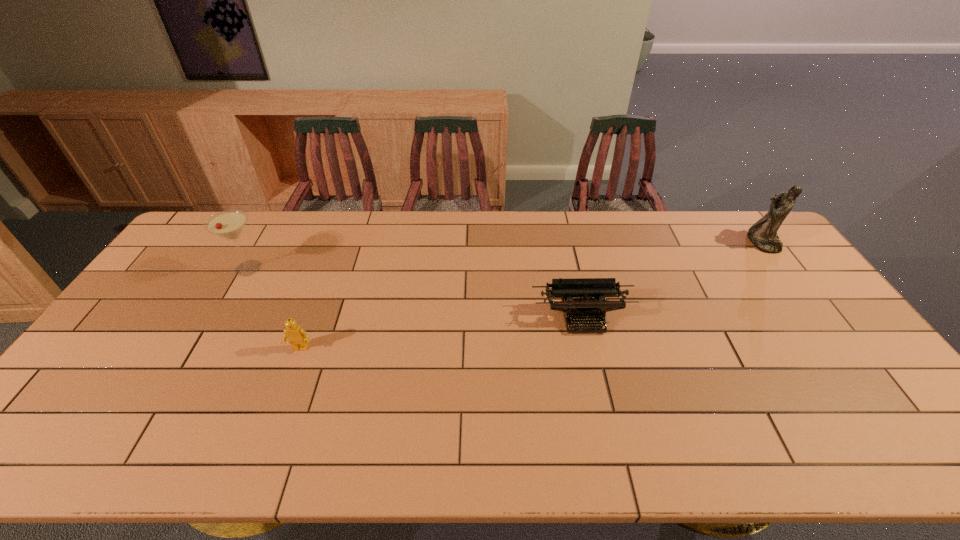
Locate an element on the screen. free space located on the front-facing side of the figurine is located at coordinates (638, 242).

Where is `free region located 0.240m on the back of the third nearest object`? This screenshot has height=540, width=960. free region located 0.240m on the back of the third nearest object is located at coordinates (279, 214).

Where is `free space located on the face of the second object from left to right`? free space located on the face of the second object from left to right is located at coordinates (278, 408).

I want to click on vacant space located on the typing side of the typewriter, so click(589, 349).

Find the location of a particular element. Image resolution: width=960 pixels, height=540 pixels. object at the far edge is located at coordinates (763, 234).

The width and height of the screenshot is (960, 540). Find the location of `object that is at the right edge`. object that is at the right edge is located at coordinates (763, 234).

Locate an element on the screen. This screenshot has width=960, height=540. object positioned at the far right corner is located at coordinates (763, 234).

The width and height of the screenshot is (960, 540). In the image, there is a desktop. In order to click on free space at the far edge in this screenshot , I will do `click(277, 228)`.

Where is `free space at the near edge`? free space at the near edge is located at coordinates (736, 457).

The width and height of the screenshot is (960, 540). I want to click on vacant area at the left edge of the desktop, so click(43, 423).